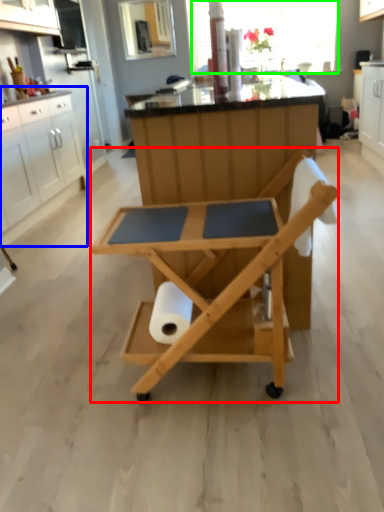
Question: Considering the real-world distances, which object is farthest from table (highlighted by a red box)? cabinetry (highlighted by a blue box) or window screen (highlighted by a green box)?

Choices:
 (A) cabinetry
 (B) window screen

Answer: (B)